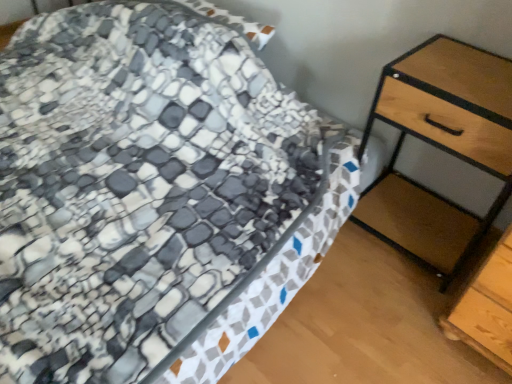
Question: Should I look upward or downward to see wooden chest of drawers at right?

Choices:
 (A) up
 (B) down

Answer: (A)